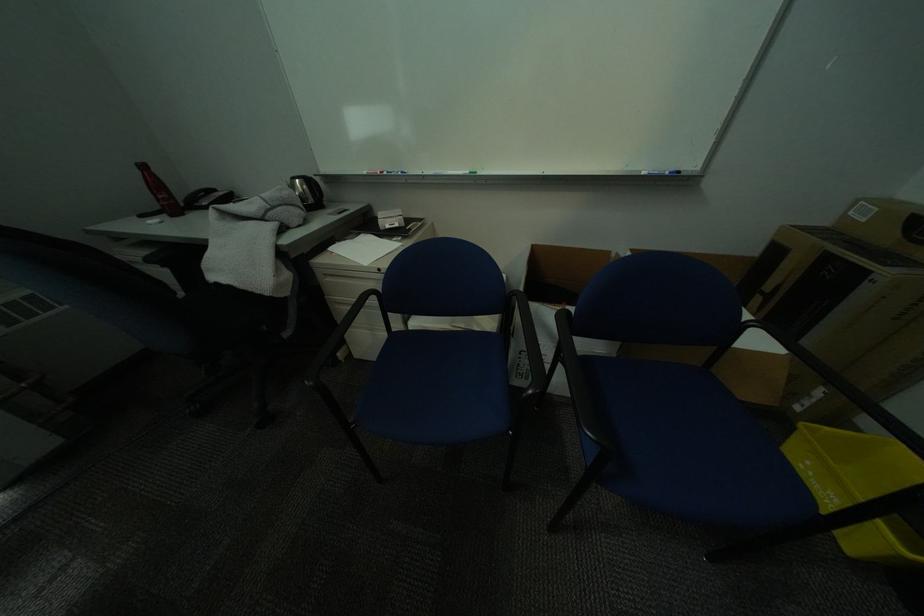
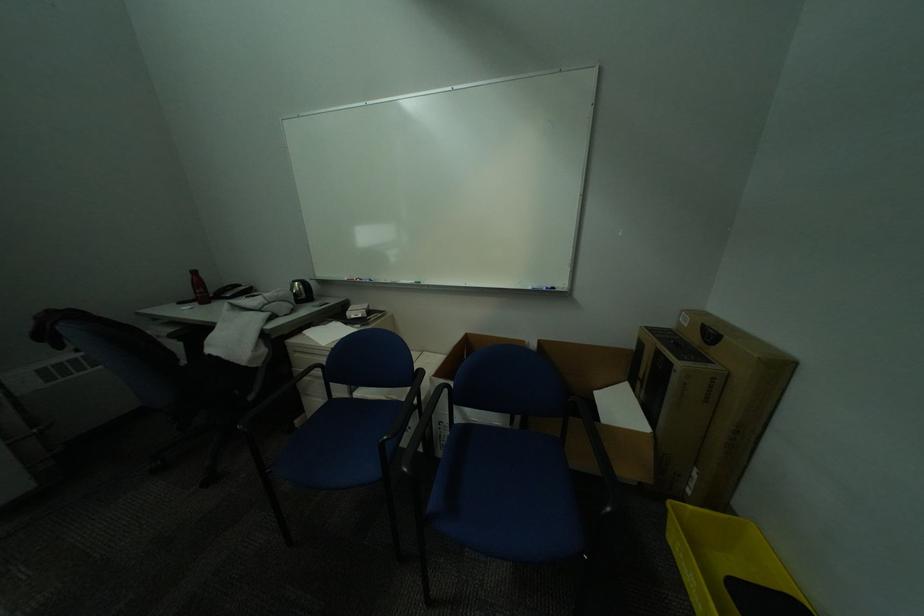
In the second image, find the point that corresponds to [531,355] in the first image.

(451, 426)